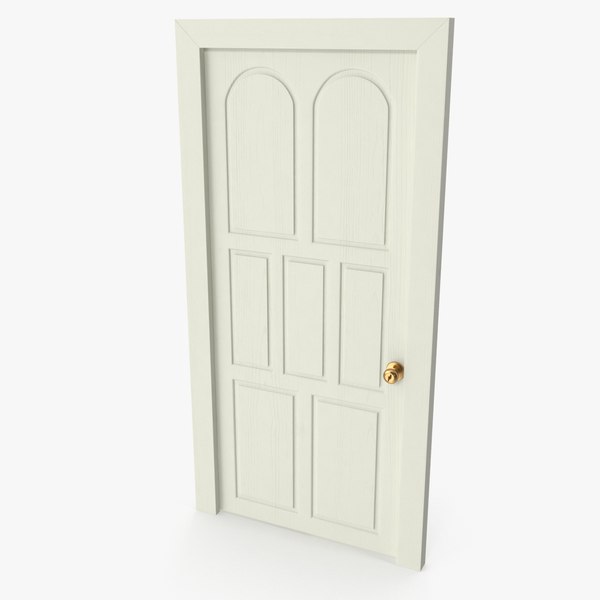
Where is `curved carved panels in door`? Image resolution: width=600 pixels, height=600 pixels. curved carved panels in door is located at coordinates click(260, 72), click(356, 73).